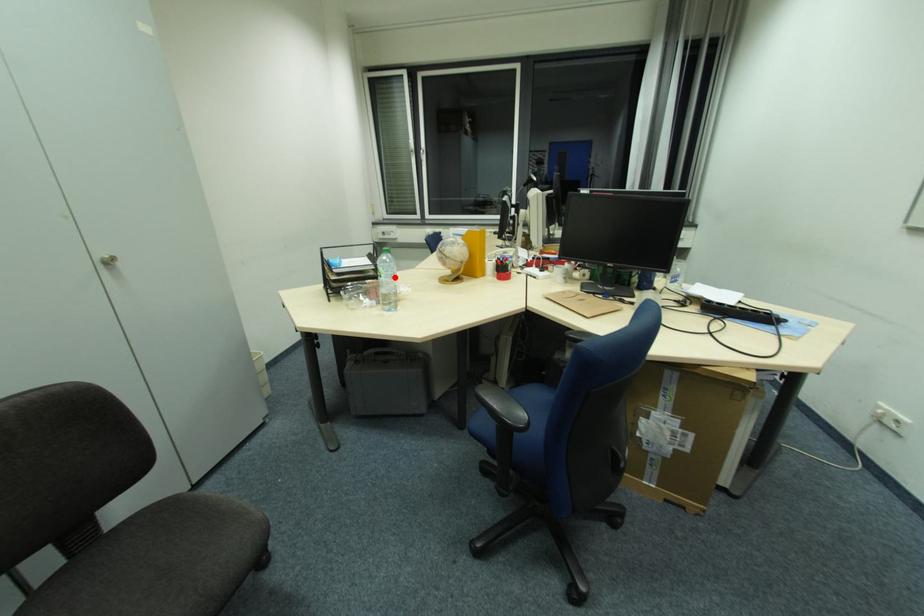
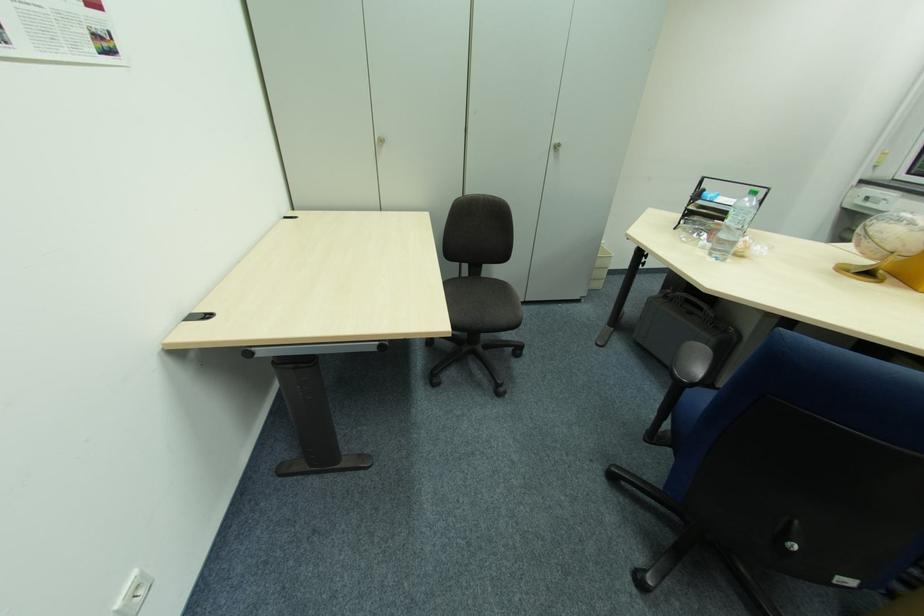
Question: I am providing you with two images of the same scene from different viewpoints. In image1, a red point is highlighted. Considering the same 3D point in image2, which of the following is correct?

Choices:
 (A) It is closer
 (B) It is farther

Answer: (B)